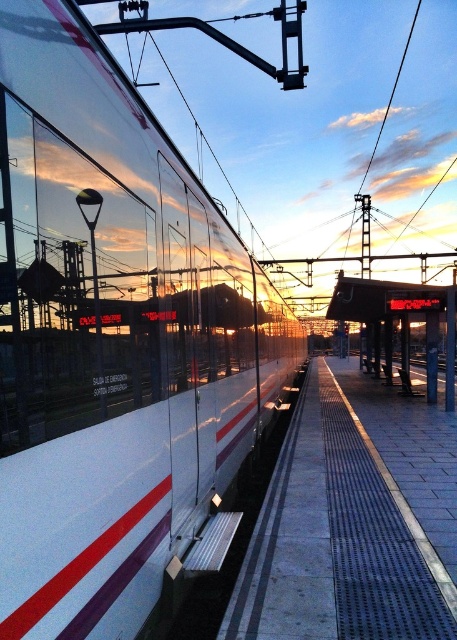
Question: In this image, where is white glossy train at center located relative to metallic platform at center?

Choices:
 (A) left
 (B) right

Answer: (A)

Question: Is smooth concrete platform at center above metallic platform at center?

Choices:
 (A) no
 (B) yes

Answer: (A)

Question: Which of the following is the farthest from the observer?

Choices:
 (A) (346, 276)
 (B) (366, 472)
 (C) (44, 392)

Answer: (A)

Question: Is white glossy train at center further to the viewer compared to smooth concrete platform at center?

Choices:
 (A) no
 (B) yes

Answer: (A)

Question: Which point is farther from the camera taking this photo?

Choices:
 (A) (292, 493)
 (B) (345, 304)

Answer: (B)

Question: Which of the following is the closest to the observer?

Choices:
 (A) (419, 314)
 (B) (20, 26)

Answer: (B)